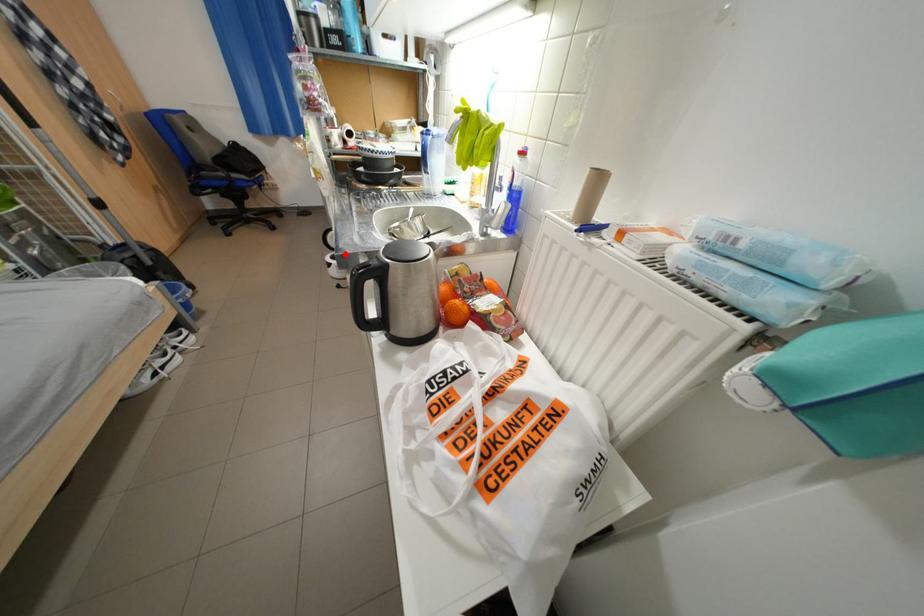
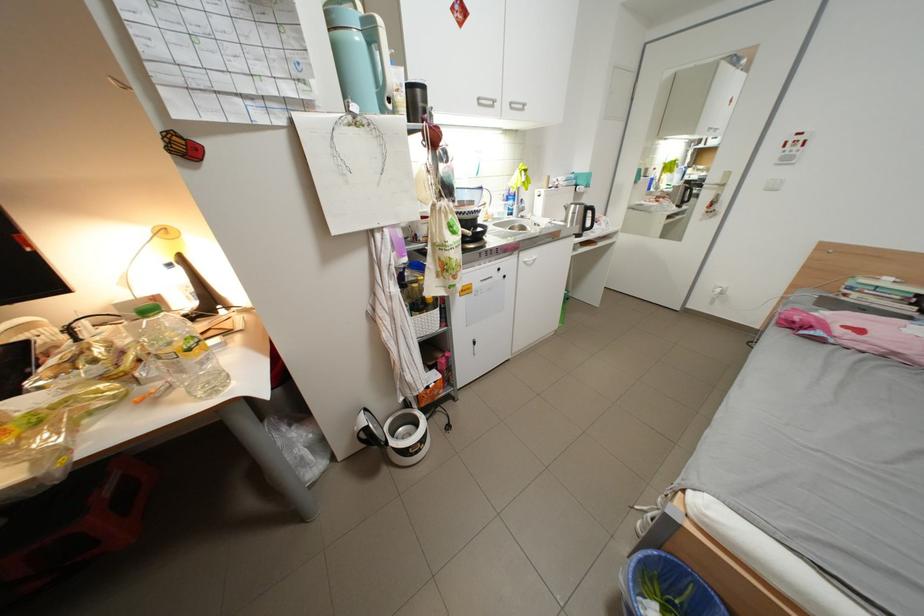
The point at the highlighted location is marked in the first image. Where is the corresponding point in the second image?

(404, 444)